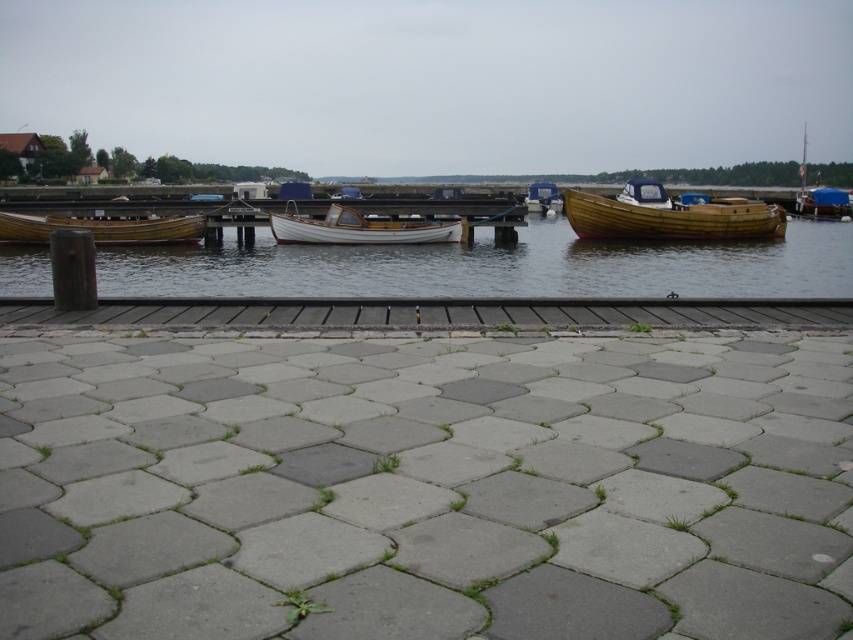
You are standing at the waterfront scene and want to determine the relative positions of two points marked in the image. Which point, point (759,301) or point (573,198), is closer to you?

Point (759,301) is closer to the viewer than point (573,198).

You are standing on the smooth wooden dock at center and want to board the wooden boat at right. Which direction should you move to reach it?

The wooden boat at right is positioned above the smooth wooden dock at center, so you should move upward to reach it.